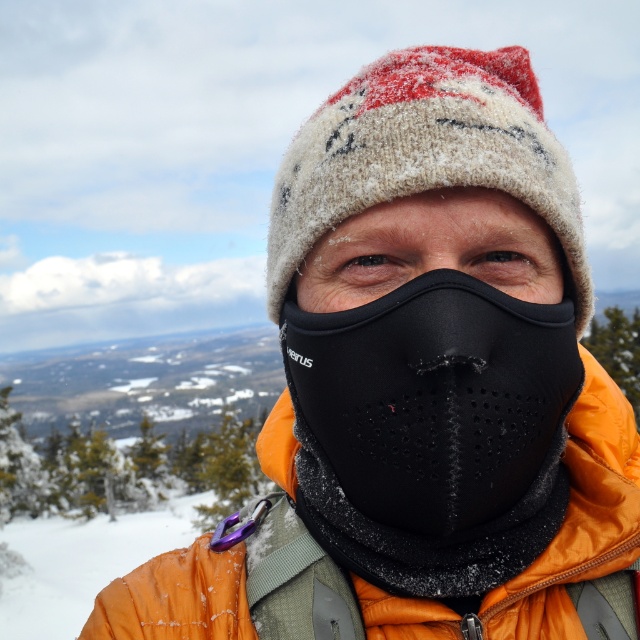
You are trying to locate the black neoprene mask at center in the snowy scene. According to the coordinates provided, where exactly is it positioned?

The black neoprene mask at center is located at point coordinates (433, 356).

You are a fashion designer analyzing winter clothing layers. You see the black neoprene mask at center and the orange fleece jacket at center. Which item is shorter in height?

The black neoprene mask at center is not as tall as the orange fleece jacket at center, so the mask is shorter in height.